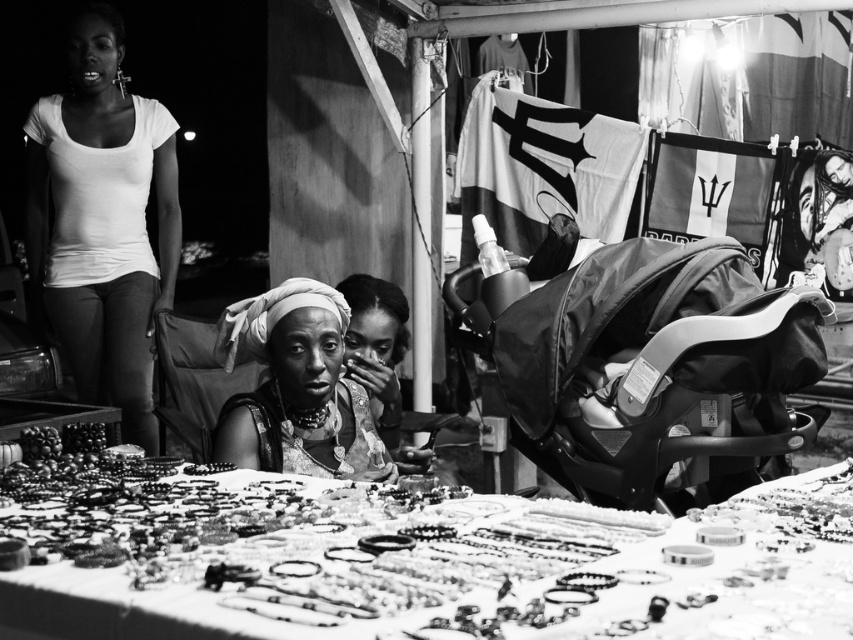
Who is higher up, white matte t-shirt at upper left or matte fabric headscarf at center?

white matte t-shirt at upper left is higher up.

The image size is (853, 640). What are the coordinates of `white matte t-shirt at upper left` in the screenshot? It's located at 102,221.

Find the location of a particular element. The height and width of the screenshot is (640, 853). white matte t-shirt at upper left is located at coordinates (102, 221).

Does metallic jewelry at center have a greater width compared to white matte t-shirt at upper left?

Yes, metallic jewelry at center is wider than white matte t-shirt at upper left.

Is metallic jewelry at center thinner than white matte t-shirt at upper left?

No, metallic jewelry at center is not thinner than white matte t-shirt at upper left.

Locate an element on the screen. Image resolution: width=853 pixels, height=640 pixels. metallic jewelry at center is located at coordinates point(410,560).

Image resolution: width=853 pixels, height=640 pixels. What do you see at coordinates (651, 364) in the screenshot? I see `matte black baby carriage at right` at bounding box center [651, 364].

The image size is (853, 640). What are the coordinates of `matte black baby carriage at right` in the screenshot? It's located at (651, 364).

Between point (607, 355) and point (166, 209), which one is positioned in front?

Point (607, 355)

Locate an element on the screen. matte black baby carriage at right is located at coordinates (651, 364).